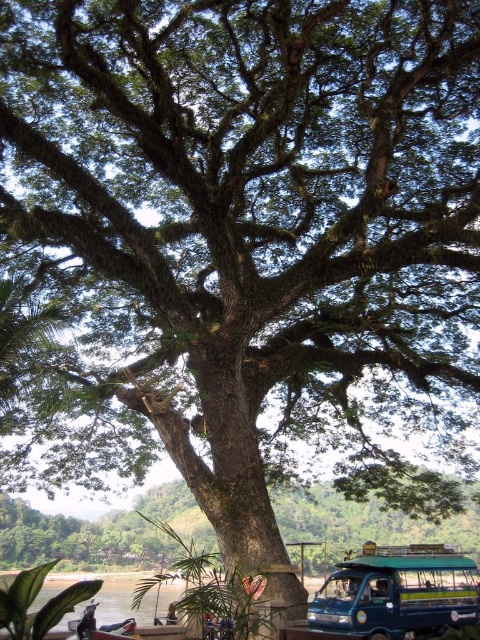
Is green rough bark tree at center behind blue metallic van at lower right?

Yes, it is.

Is green rough bark tree at center thinner than blue metallic van at lower right?

Incorrect, green rough bark tree at center's width is not less than blue metallic van at lower right's.

Is point (132, 540) closer to viewer compared to point (349, 625)?

No, (132, 540) is behind (349, 625).

In order to click on green rough bark tree at center in this screenshot , I will do point(100,531).